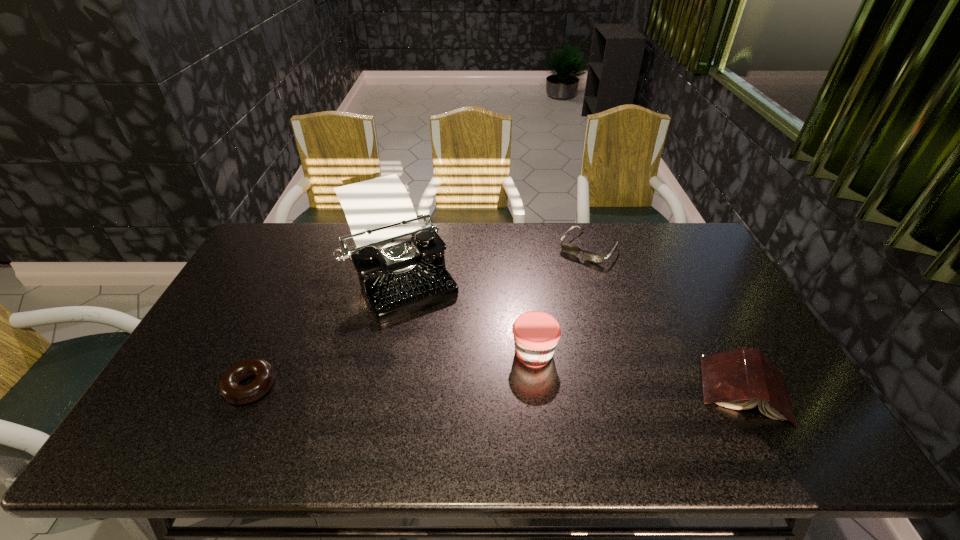
You are a GUI agent. You are given a task and a screenshot of the screen. Output one action in this format:
    pyautogui.click(x=<x>, y=<y>)
    Task: Click on the free spot located 0.230m on the front label of the fourth shortest object
    
    Given the screenshot: What is the action you would take?
    pyautogui.click(x=438, y=401)

This screenshot has width=960, height=540. What are the coordinates of `free space located 0.190m on the front label of the fourth shortest object` in the screenshot? It's located at (452, 394).

The image size is (960, 540). What are the coordinates of `vacant space located on the front label of the fourth shortest object` in the screenshot? It's located at (448, 396).

Locate an element on the screen. The image size is (960, 540). free spot located on the keys of the typewriter is located at coordinates [x=447, y=365].

The height and width of the screenshot is (540, 960). In order to click on vacant space situated on the keys of the typewriter in this screenshot , I will do `click(444, 357)`.

At what (x,y) coordinates should I click in order to perform the action: click on vacant point located on the keys of the typewriter. Please return your answer as a coordinate pair (x, y). Looking at the image, I should click on (466, 397).

You are a GUI agent. You are given a task and a screenshot of the screen. Output one action in this format:
    pyautogui.click(x=<x>, y=<y>)
    Task: Click on the free space located on the front-facing side of the fourth object from left to right
    The width and height of the screenshot is (960, 540).
    Given the screenshot: What is the action you would take?
    pyautogui.click(x=554, y=290)

Locate an element on the screen. The height and width of the screenshot is (540, 960). vacant space located on the front-facing side of the fourth object from left to right is located at coordinates (554, 290).

Identify the location of vacant region located 0.090m on the front-facing side of the fourth object from left to right. (564, 278).

Image resolution: width=960 pixels, height=540 pixels. Find the location of `typewriter that is positioned at the far edge`. typewriter that is positioned at the far edge is located at coordinates (401, 268).